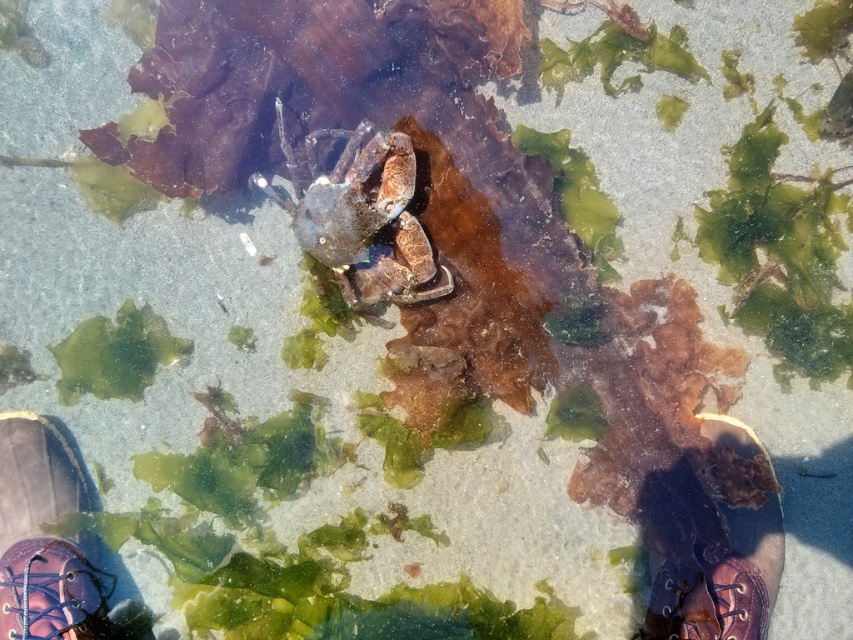
You are a scuba diver who needs to retrieve two shiny purple shoes underwater. The shoes are located at the lower left and lower right of your current position. If your maximum reach without moving is 1 meter, can you grab both shiny purple shoe at lower left and shiny purple shoe at lower right at the same time?

The shiny purple shoe at lower left and shiny purple shoe at lower right are 1.17 meters apart from each other. Since your maximum reach is 1 meter, you cannot grab both shiny purple shoe at lower left and shiny purple shoe at lower right at the same time without moving closer.

You are a scuba diver searching for a pair of shiny purple shoes underwater. You spot the shiny purple shoe at lower left and the shiny purple shoe at lower right. Which one is bigger?

The shiny purple shoe at lower left is larger in size than the shiny purple shoe at lower right.